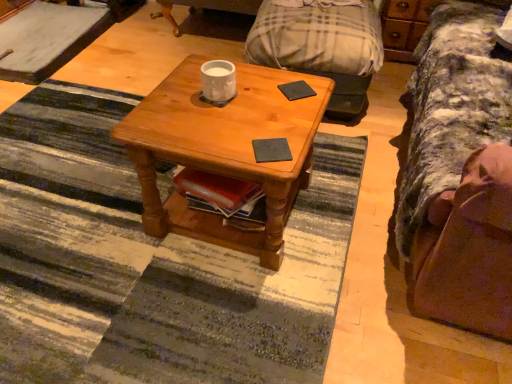
Question: From a real-world perspective, is white glossy mug at center beneath black matte pad at center, which ranks as the second pad in top-to-bottom order?

Choices:
 (A) no
 (B) yes

Answer: (A)

Question: Is white glossy mug at center behind black matte pad at center, which ranks as the second pad in top-to-bottom order?

Choices:
 (A) yes
 (B) no

Answer: (A)

Question: Is white glossy mug at center touching black matte pad at center, which is the second pad from back to front?

Choices:
 (A) no
 (B) yes

Answer: (A)

Question: Considering the relative sizes of white glossy mug at center and black matte pad at center, which ranks as the second pad in top-to-bottom order, in the image provided, is white glossy mug at center thinner than black matte pad at center, which ranks as the second pad in top-to-bottom order,?

Choices:
 (A) yes
 (B) no

Answer: (B)

Question: From the image's perspective, is white glossy mug at center over black matte pad at center, the first pad from the bottom?

Choices:
 (A) yes
 (B) no

Answer: (A)

Question: From the image's perspective, is black matte pad at center, the second pad from the bottom, above or below wooden coffee table at center?

Choices:
 (A) below
 (B) above

Answer: (B)

Question: Is black matte pad at center, the 1th pad in the back-to-front sequence, taller or shorter than wooden coffee table at center?

Choices:
 (A) tall
 (B) short

Answer: (B)

Question: Is black matte pad at center, the 1th pad in the back-to-front sequence, wider or thinner than wooden coffee table at center?

Choices:
 (A) wide
 (B) thin

Answer: (B)

Question: Is black matte pad at center, the 1th pad in the back-to-front sequence, spatially inside wooden coffee table at center, or outside of it?

Choices:
 (A) inside
 (B) outside

Answer: (A)

Question: Considering the positions of point (224, 62) and point (285, 157), is point (224, 62) closer or farther from the camera than point (285, 157)?

Choices:
 (A) closer
 (B) farther

Answer: (B)

Question: Would you say white glossy mug at center is to the left or to the right of black matte pad at center, arranged as the 1th pad when viewed from the front, in the picture?

Choices:
 (A) left
 (B) right

Answer: (A)

Question: Considering their positions, is white glossy mug at center located in front of or behind black matte pad at center, the first pad from the bottom?

Choices:
 (A) front
 (B) behind

Answer: (B)

Question: Considering the positions of white glossy mug at center and black matte pad at center, which ranks as the second pad in top-to-bottom order, in the image, is white glossy mug at center wider or thinner than black matte pad at center, which ranks as the second pad in top-to-bottom order,?

Choices:
 (A) wide
 (B) thin

Answer: (A)

Question: Considering their positions, is wooden coffee table at center located in front of or behind wooden dresser at upper right?

Choices:
 (A) behind
 (B) front

Answer: (B)

Question: Would you say wooden coffee table at center is to the left or to the right of wooden dresser at upper right in the picture?

Choices:
 (A) right
 (B) left

Answer: (B)